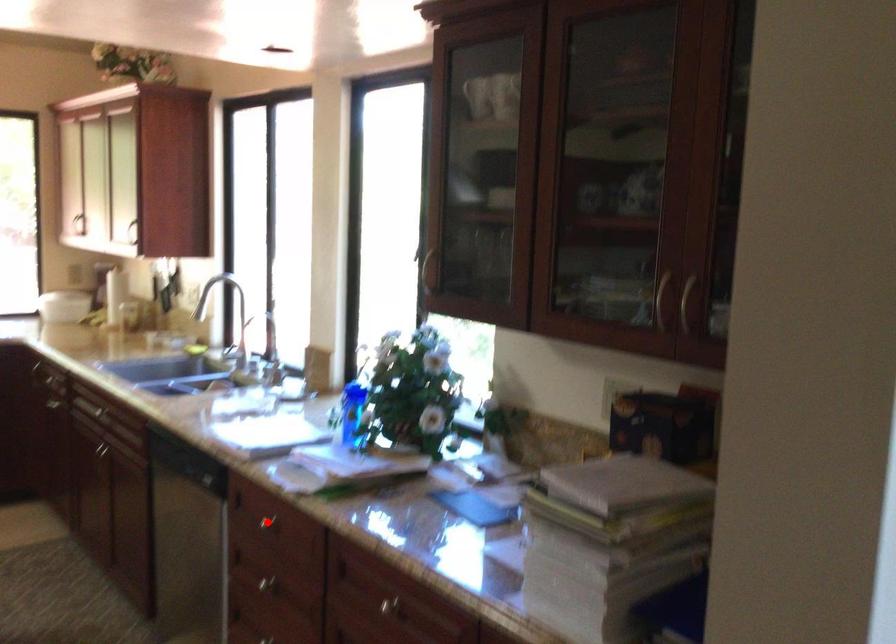
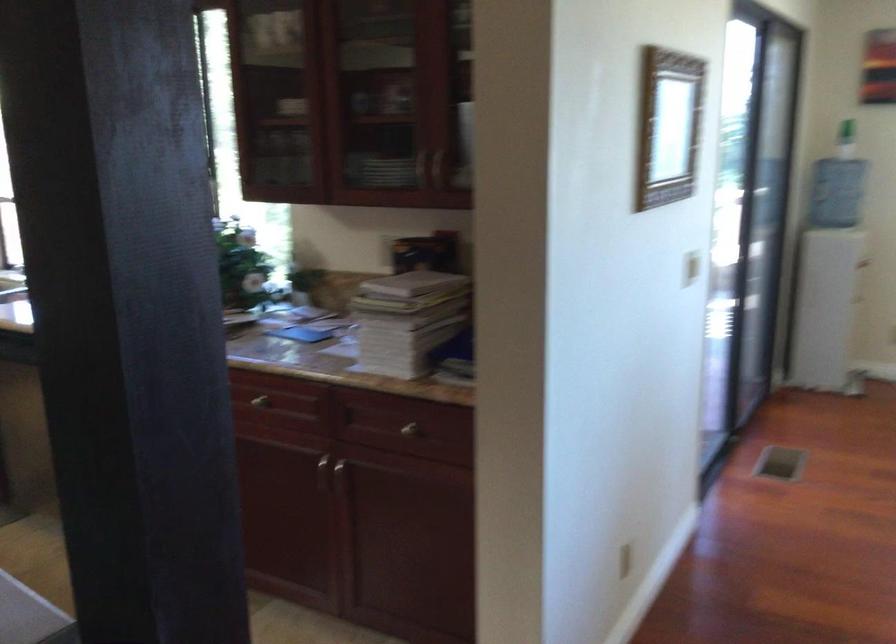
Question: I am providing you with two images of the same scene from different viewpoints. A red point is marked on the first image. Is the red point's position out of view in image 2?

Choices:
 (A) Yes
 (B) No

Answer: (A)